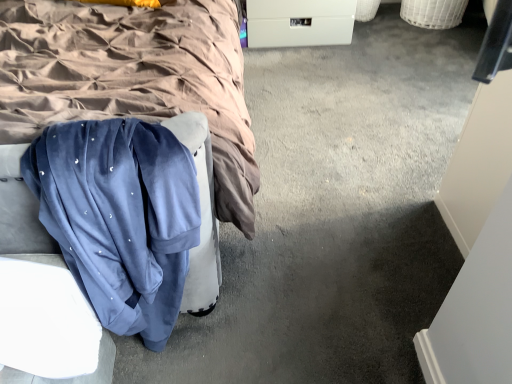
Question: Would you say velvet blue blanket at center is inside or outside velvet blue sweatpants at lower left?

Choices:
 (A) outside
 (B) inside

Answer: (A)

Question: Is velvet blue blanket at center in front of or behind velvet blue sweatpants at lower left in the image?

Choices:
 (A) front
 (B) behind

Answer: (A)

Question: Which object is the farthest from the white plastic drawer at center?

Choices:
 (A) velvet blue sweatpants at lower left
 (B) velvet blue blanket at center

Answer: (A)

Question: Based on their relative distances, which object is nearer to the velvet blue sweatpants at lower left?

Choices:
 (A) white plastic drawer at center
 (B) velvet blue blanket at center

Answer: (B)